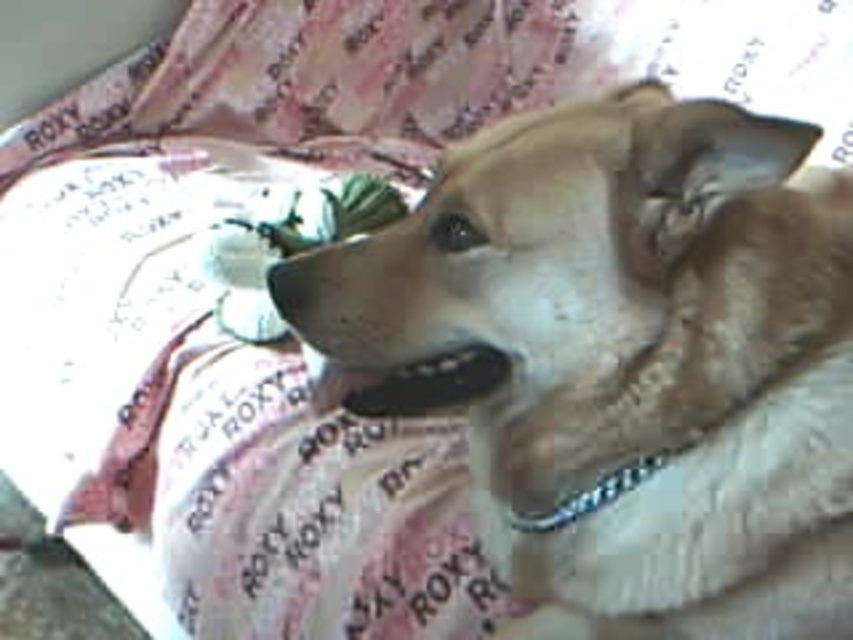
You are a photographer trying to capture the perfect shot of the dog. You notice two points in the image labeled as point (834, 332) and point (281, 225). Which point is closer to your camera lens?

Point (834, 332) is closer to the viewer than point (281, 225), so the photographer should focus on that point for a clearer shot.

You are a dog owner who wants to ensure your pet is comfortable. Looking at the image, which object is taller between the light brown fur at center and the metallic chain at center?

The light brown fur at center is much taller than the metallic chain at center, so the fur is taller.

You are a photographer setting up a shot of the dog with the green fabric flower at center and the metallic chain at center. Which object will appear larger in the photo?

The green fabric flower at center will appear larger in the photo because it is closer to the viewer than the metallic chain at center.